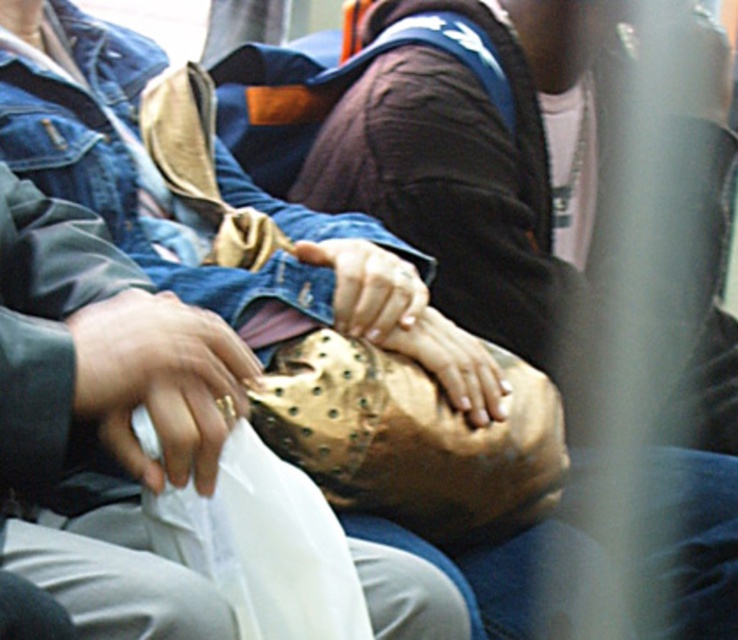
You are a photographer trying to capture the gold metallic mask at center in the image. The camera you are using has a focus point at coordinate point (x=489, y=170). Will this focus point be effective for capturing the mask?

The gold metallic mask at center is represented by point (x=489, y=170), so yes, the focus point at coordinate point (x=489, y=170) will effectively capture the mask.

You are an art curator planning to display the gold metallic mask at center and the matte gold ring at center in a museum exhibit. Based on their sizes, which object should be placed in a larger display case to accommodate its dimensions?

The gold metallic mask at center is larger in size than the matte gold ring at center, so it should be placed in a larger display case to accommodate its dimensions.